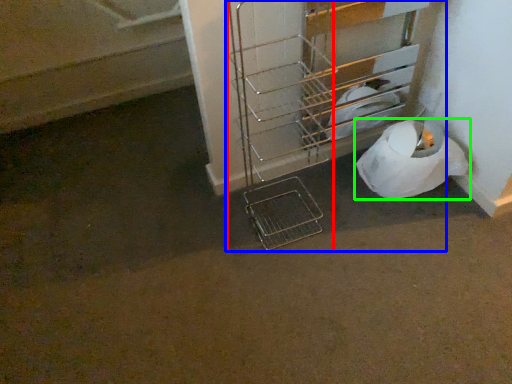
Question: Considering the real-world distances, which object is closest to trolley (highlighted by a red box)? trolley (highlighted by a blue box) or toilet paper (highlighted by a green box).

Choices:
 (A) trolley
 (B) toilet paper

Answer: (A)